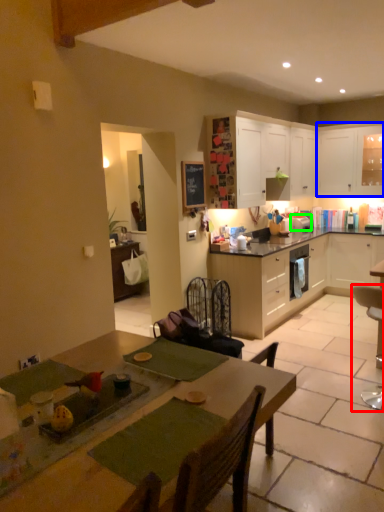
Question: Considering the real-world distances, which object is farthest from chair (highlighted by a red box)? cabinetry (highlighted by a blue box) or appliance (highlighted by a green box)?

Choices:
 (A) cabinetry
 (B) appliance

Answer: (A)